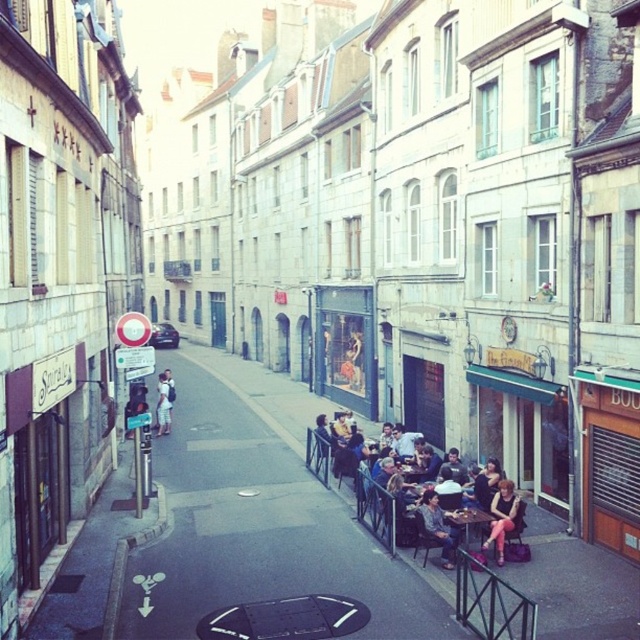
Can you confirm if denim shorts at lower right is taller than light brown leather jacket at center?

In fact, denim shorts at lower right may be shorter than light brown leather jacket at center.

Image resolution: width=640 pixels, height=640 pixels. I want to click on denim shorts at lower right, so click(502, 516).

Does wooden table at lower right have a lesser width compared to light brown leather jacket at center?

Correct, wooden table at lower right's width is less than light brown leather jacket at center's.

Can you confirm if wooden table at lower right is smaller than light brown leather jacket at center?

Indeed, wooden table at lower right has a smaller size compared to light brown leather jacket at center.

Where is `wooden table at lower right`? wooden table at lower right is located at coordinates (468, 525).

Does denim jacket at lower right come behind light brown leather jacket at center?

No, it is not.

Is denim jacket at lower right bigger than light brown leather jacket at center?

Incorrect, denim jacket at lower right is not larger than light brown leather jacket at center.

Image resolution: width=640 pixels, height=640 pixels. Identify the location of denim jacket at lower right. (436, 525).

The image size is (640, 640). I want to click on denim jacket at lower right, so click(436, 525).